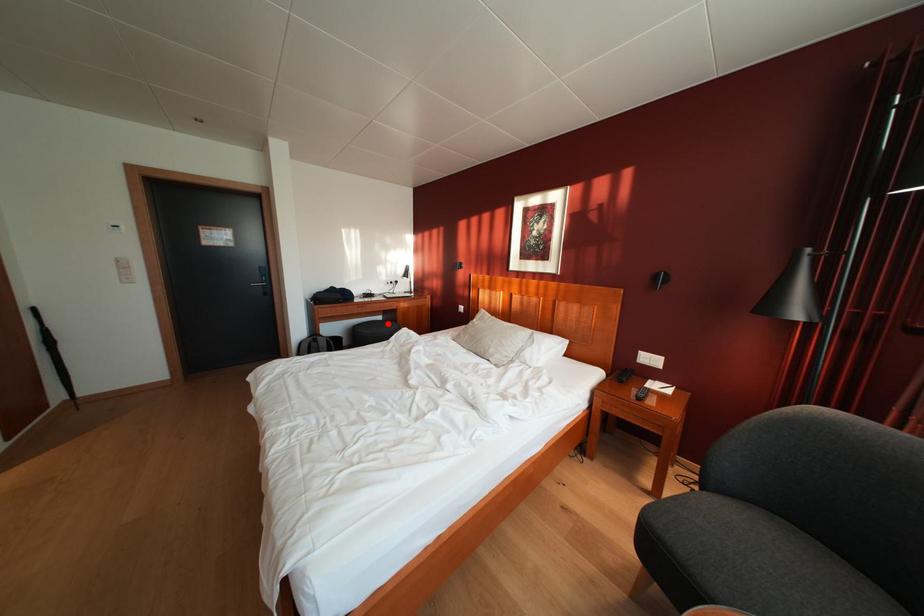
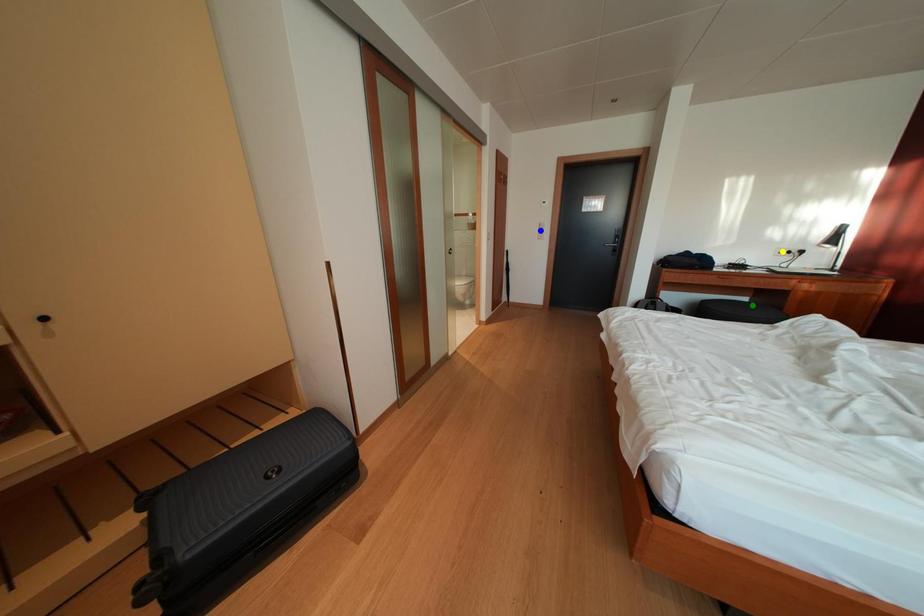
Question: I am providing you with two images of the same scene from different viewpoints. A red point is marked on the first image. You are given multiple points on the second image. Which spot in image 2 lines up with the point in image 1?

Choices:
 (A) blue point
 (B) green point
 (C) yellow point

Answer: (B)